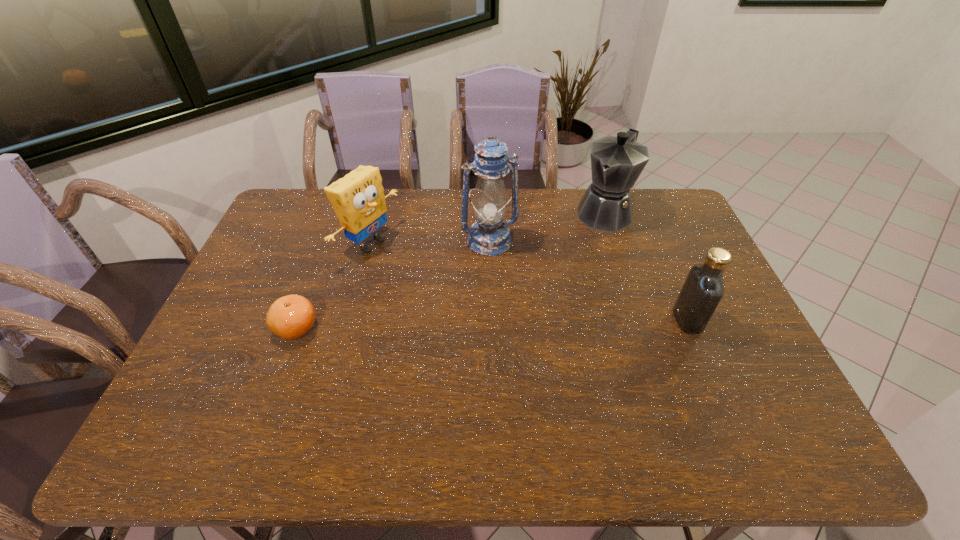
Find the location of a particular element. Image resolution: width=960 pixels, height=540 pixels. empty location between the vodka and the shortest object is located at coordinates coord(492,324).

The height and width of the screenshot is (540, 960). In order to click on empty space that is in between the rightmost object and the second object from right to left in this screenshot , I will do `click(645, 266)`.

Find the location of a particular element. This screenshot has height=540, width=960. empty location between the coffeepot and the vodka is located at coordinates (645, 266).

The width and height of the screenshot is (960, 540). In order to click on blank region between the lantern and the rightmost object in this screenshot , I will do `click(588, 280)`.

Where is `empty space between the rightmost object and the third object from right to left`? The height and width of the screenshot is (540, 960). empty space between the rightmost object and the third object from right to left is located at coordinates (588, 280).

The width and height of the screenshot is (960, 540). Find the location of `vacant space in between the clementine and the vodka`. vacant space in between the clementine and the vodka is located at coordinates (492, 324).

Locate an element on the screen. The height and width of the screenshot is (540, 960). object that ranks as the closest to the fourth shortest object is located at coordinates (489, 236).

Where is `object that is the second nearest to the sponge`? The image size is (960, 540). object that is the second nearest to the sponge is located at coordinates (489, 236).

Find the location of a particular element. This screenshot has height=540, width=960. blank area in the image that satisfies the following two spatial constraints: 1. on the back side of the lantern; 2. on the left side of the sponge is located at coordinates (372, 241).

Where is `vacant area that satisfies the following two spatial constraints: 1. on the back side of the shortest object; 2. on the front-facing side of the vodka`? vacant area that satisfies the following two spatial constraints: 1. on the back side of the shortest object; 2. on the front-facing side of the vodka is located at coordinates (300, 320).